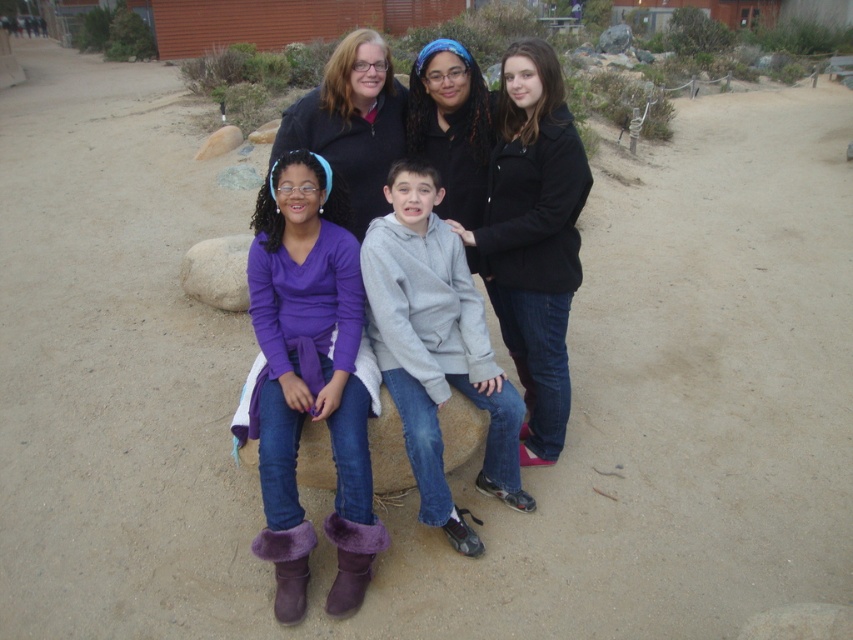
Question: Is gray fleece hoodie at center in front of matte black jacket at upper center?

Choices:
 (A) no
 (B) yes

Answer: (B)

Question: Estimate the real-world distances between objects in this image. Which object is closer to the gray fleece hoodie at center?

Choices:
 (A) purple fuzzy boots at lower center
 (B) matte black jacket at upper center
 (C) smooth beige rock at center
 (D) black matte jacket at upper right

Answer: (A)

Question: Which object appears closest to the camera in this image?

Choices:
 (A) black matte jacket at upper right
 (B) purple fuzzy boots at lower center
 (C) gray fleece hoodie at center

Answer: (B)

Question: Does purple fuzzy boots at lower center appear over purple fleece sweater at center?

Choices:
 (A) no
 (B) yes

Answer: (A)

Question: Can you confirm if gray fleece hoodie at center is positioned to the left of smooth beige rock at center?

Choices:
 (A) yes
 (B) no

Answer: (B)

Question: Which point is farther from the camera taking this photo?

Choices:
 (A) (370, 490)
 (B) (563, 256)
 (C) (242, 300)

Answer: (C)